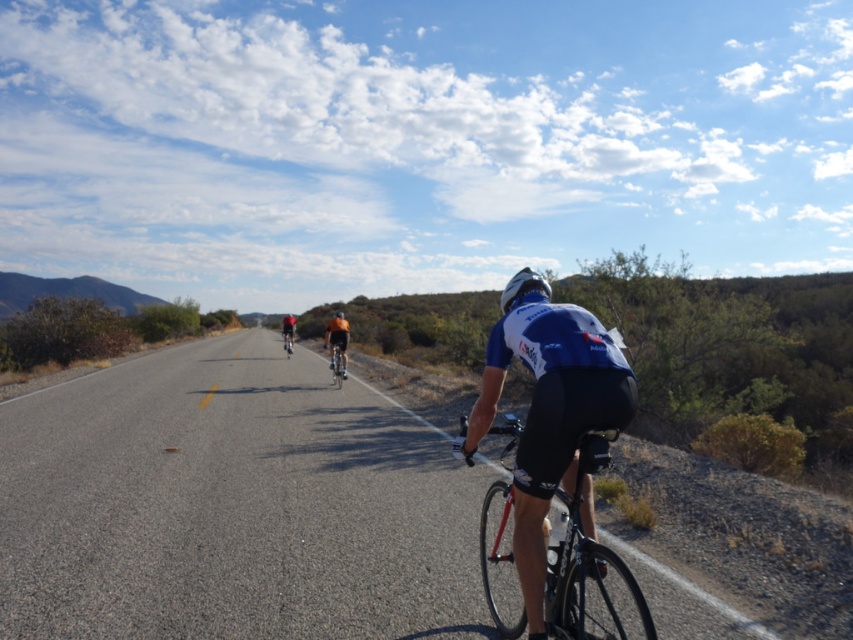
You are a cyclist approaching the orange fabric cyclist at center and the shiny silver bicycle at center. The road ahead is straight and clear. Can you safely overtake both within the next 10 seconds if you maintain your current speed of 20 km per hour?

The distance between the orange fabric cyclist at center and the shiny silver bicycle at center is 5.56 meters. At 20 km per hour, you can cover approximately 5.56 meters in about 1 second. Since the road is straight and clear, you can safely overtake both within the next 10 seconds.

You are a cyclist in the scene and want to know if the point at coordinates point (525, 275) is ahead of point (334, 371) along the road. Based on the image, can you confirm this?

Yes, point (525, 275) is in front of point (334, 371) along the road.